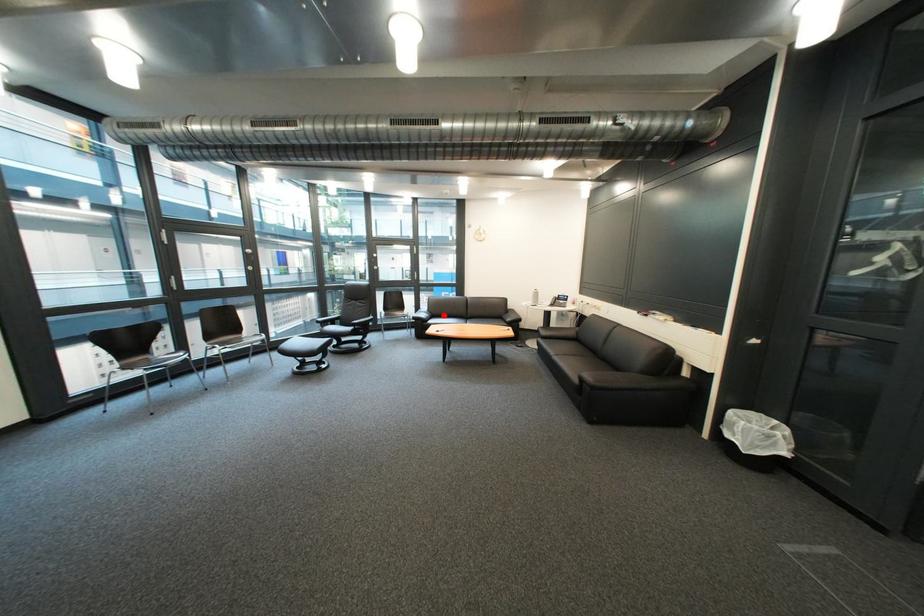
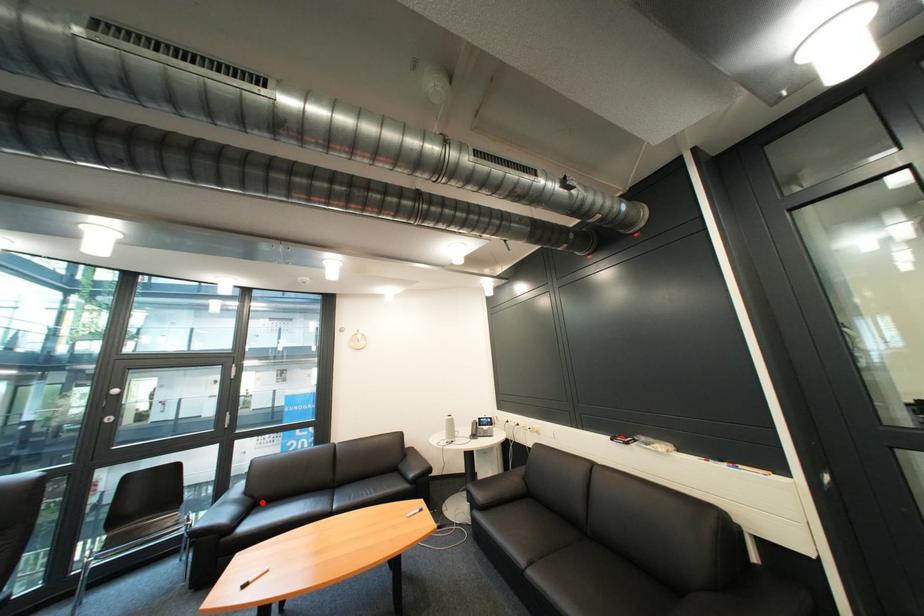
I am providing you with two images of the same scene from different viewpoints. A red point is marked on the first image and another point is marked on the second image. Does the point marked in image1 correspond to the same location as the one in image2?

Yes